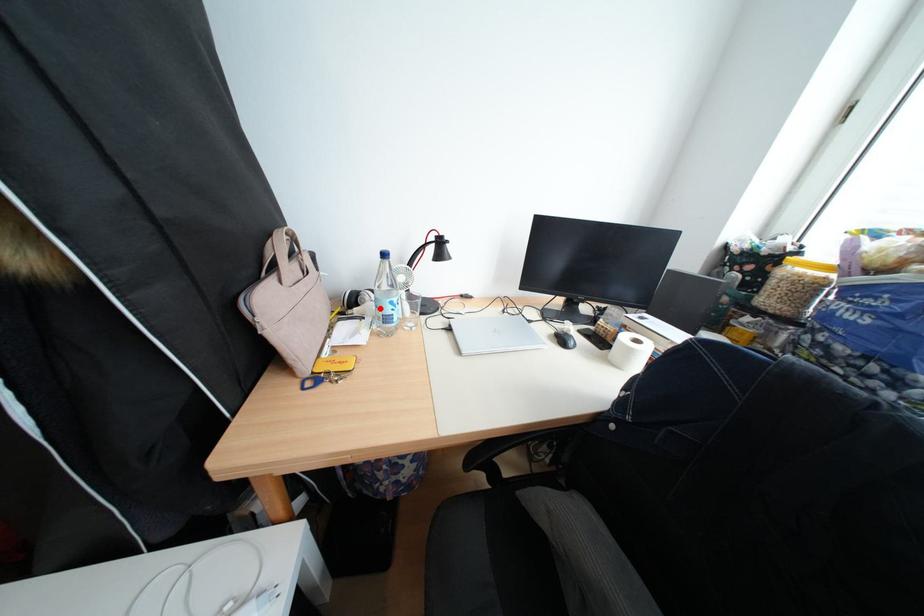
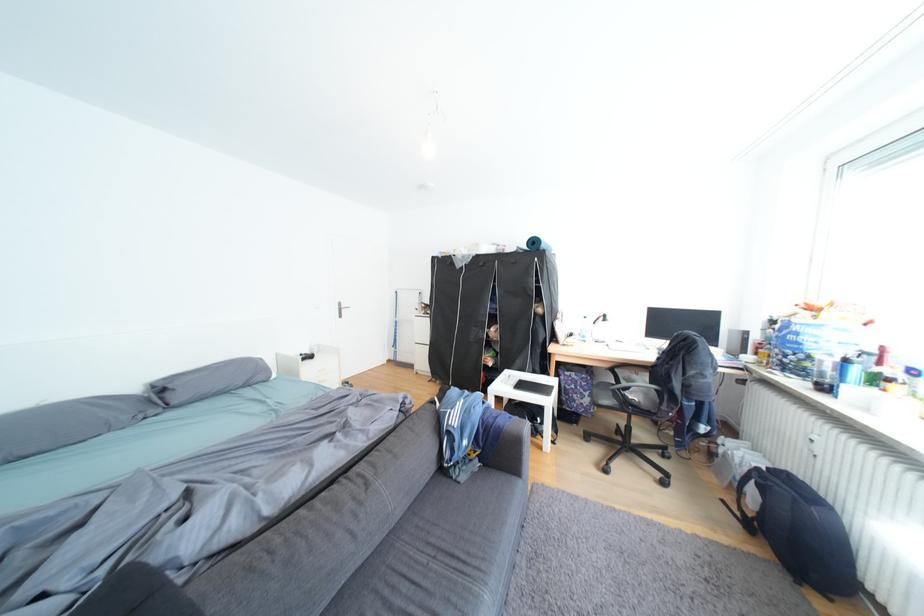
Where in the second image is the point corresponding to the highlighted location from the first image?

(590, 337)